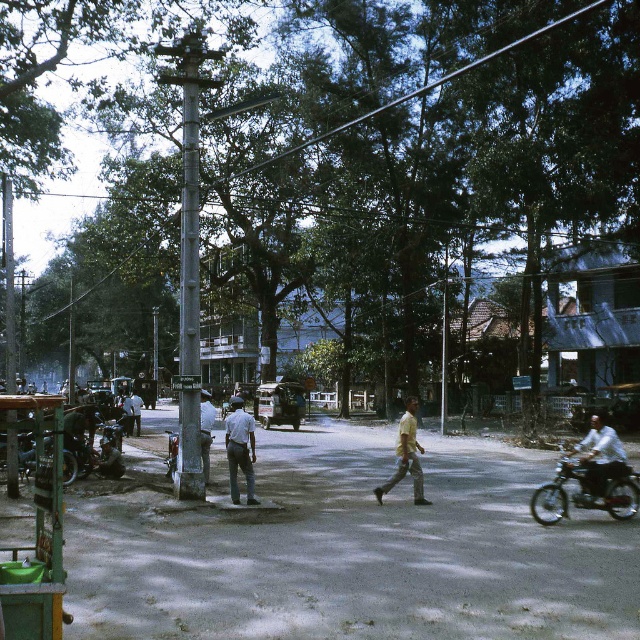
Can you confirm if light blue shirt at center is thinner than shiny chrome motorcycle at lower left?

Yes.

Is light blue shirt at center bigger than shiny chrome motorcycle at lower left?

Incorrect, light blue shirt at center is not larger than shiny chrome motorcycle at lower left.

Is point (208, 438) more distant than point (173, 472)?

That is False.

Where is `light blue shirt at center`? The width and height of the screenshot is (640, 640). light blue shirt at center is located at coordinates pos(205,429).

Does white textured shirt at right have a lesser width compared to shiny chrome motorcycle at lower left?

Indeed, white textured shirt at right has a lesser width compared to shiny chrome motorcycle at lower left.

Locate an element on the screen. This screenshot has width=640, height=640. white textured shirt at right is located at coordinates (600, 458).

Between point (618, 467) and point (404, 470), which one is positioned behind?

Positioned behind is point (404, 470).

Is white textured shirt at right bigger than yellow matte shirt at center?

Incorrect, white textured shirt at right is not larger than yellow matte shirt at center.

Is point (605, 452) farther from camera compared to point (410, 474)?

No, (605, 452) is in front of (410, 474).

I want to click on white textured shirt at right, so click(600, 458).